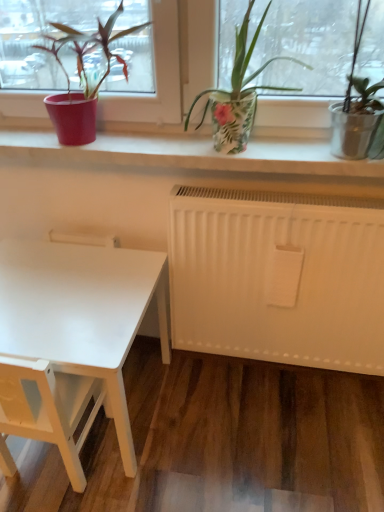
The width and height of the screenshot is (384, 512). Describe the element at coordinates (238, 93) in the screenshot. I see `floral-patterned pot at center, the first houseplant in the right-to-left sequence` at that location.

This screenshot has width=384, height=512. Find the location of `white matte table at lower left`. white matte table at lower left is located at coordinates (82, 314).

At what (x,y) coordinates should I click in order to perform the action: click on floral-patterned pot at center, acting as the 2th houseplant starting from the left. Please return your answer as a coordinate pair (x, y). Looking at the image, I should click on click(238, 93).

Based on the photo, from a real-world perspective, which object stands above the other?

floral-patterned pot at center, the first houseplant in the right-to-left sequence.

Who is more distant, white matte table at lower left or floral-patterned pot at center, acting as the 2th houseplant starting from the left?

Positioned behind is white matte table at lower left.

Is white matte table at lower left turned away from floral-patterned pot at center, the first houseplant in the right-to-left sequence?

That's not correct — white matte table at lower left is not looking away from floral-patterned pot at center, the first houseplant in the right-to-left sequence.

From a real-world perspective, which is physically below, floral-patterned pot at center, the first houseplant in the right-to-left sequence, or white matte table at lower left?

In real-world perspective, white matte table at lower left is lower.

Looking at this image, is floral-patterned pot at center, acting as the 2th houseplant starting from the left, wider than white matte table at lower left?

Incorrect, the width of floral-patterned pot at center, acting as the 2th houseplant starting from the left, does not surpass that of white matte table at lower left.

Between floral-patterned pot at center, the first houseplant in the right-to-left sequence, and white matte table at lower left, which one has smaller size?

floral-patterned pot at center, the first houseplant in the right-to-left sequence.

Can you confirm if floral-patterned pot at center, the first houseplant in the right-to-left sequence, is taller than white matte table at lower left?

No.

Would you say floral-patterned pot at center, acting as the 2th houseplant starting from the left, is a long distance from matte red pot at left, which is counted as the second houseplant, starting from the right?

floral-patterned pot at center, acting as the 2th houseplant starting from the left, is actually quite close to matte red pot at left, which is counted as the second houseplant, starting from the right.

From the image's perspective, is floral-patterned pot at center, acting as the 2th houseplant starting from the left, under matte red pot at left, arranged as the 1th houseplant when viewed from the left?

Indeed, from the image's perspective, floral-patterned pot at center, acting as the 2th houseplant starting from the left, is shown beneath matte red pot at left, arranged as the 1th houseplant when viewed from the left.

Is floral-patterned pot at center, acting as the 2th houseplant starting from the left, inside or outside of matte red pot at left, which is counted as the second houseplant, starting from the right?

floral-patterned pot at center, acting as the 2th houseplant starting from the left, is not inside matte red pot at left, which is counted as the second houseplant, starting from the right, it's outside.

Would you say floral-patterned pot at center, acting as the 2th houseplant starting from the left, is to the left or to the right of matte red pot at left, arranged as the 1th houseplant when viewed from the left, in the picture?

From the image, it's evident that floral-patterned pot at center, acting as the 2th houseplant starting from the left, is to the right of matte red pot at left, arranged as the 1th houseplant when viewed from the left.

From the image's perspective, would you say matte red pot at left, which is counted as the second houseplant, starting from the right, is positioned over white matte table at lower left?

Yes.

Is matte red pot at left, arranged as the 1th houseplant when viewed from the left, not close to white matte table at lower left?

matte red pot at left, arranged as the 1th houseplant when viewed from the left, is near white matte table at lower left, not far away.

Which object is wider, matte red pot at left, which is counted as the second houseplant, starting from the right, or white matte table at lower left?

Wider between the two is white matte table at lower left.

Is white matte table at lower left turned away from white matte table at lower left?

Yes, white matte table at lower left is facing away from white matte table at lower left.

Looking at this image, is white matte table at lower left not near white matte table at lower left?

No, white matte table at lower left is in close proximity to white matte table at lower left.

From the image's perspective, which is below, white matte table at lower left or white matte table at lower left?

white matte table at lower left is shown below in the image.

What's the angular difference between white matte table at lower left and matte red pot at left, arranged as the 1th houseplant when viewed from the left,'s facing directions?

They differ by 178 degrees in their facing directions.

Is the surface of white matte table at lower left in direct contact with matte red pot at left, which is counted as the second houseplant, starting from the right?

No.

Consider the image. From their relative heights in the image, would you say white matte table at lower left is taller or shorter than matte red pot at left, which is counted as the second houseplant, starting from the right?

Clearly, white matte table at lower left is taller compared to matte red pot at left, which is counted as the second houseplant, starting from the right.

Is white matte table at lower left facing away from matte red pot at left, which is counted as the second houseplant, starting from the right?

No, white matte table at lower left's orientation is not away from matte red pot at left, which is counted as the second houseplant, starting from the right.

Which of these two, floral-patterned pot at center, acting as the 2th houseplant starting from the left, or white matte table at lower left, stands shorter?

floral-patterned pot at center, acting as the 2th houseplant starting from the left.

Can you confirm if floral-patterned pot at center, the first houseplant in the right-to-left sequence, is wider than white matte table at lower left?

Incorrect, the width of floral-patterned pot at center, the first houseplant in the right-to-left sequence, does not surpass that of white matte table at lower left.

Could you tell me if floral-patterned pot at center, acting as the 2th houseplant starting from the left, is facing white matte table at lower left?

No, floral-patterned pot at center, acting as the 2th houseplant starting from the left, is not aimed at white matte table at lower left.

Is floral-patterned pot at center, the first houseplant in the right-to-left sequence, far away from white matte table at lower left?

floral-patterned pot at center, the first houseplant in the right-to-left sequence, is actually quite close to white matte table at lower left.

This screenshot has width=384, height=512. What are the coordinates of `houseplant that is the 1st object located above the white matte table at lower left (from the image's perspective)` in the screenshot? It's located at [x=238, y=93].

You are a GUI agent. You are given a task and a screenshot of the screen. Output one action in this format:
    pyautogui.click(x=<x>, y=<y>)
    Task: Click on the table below the floral-patterned pot at center, acting as the 2th houseplant starting from the left (from a real-world perspective)
    Image resolution: width=384 pixels, height=512 pixels.
    Given the screenshot: What is the action you would take?
    pyautogui.click(x=82, y=314)

Based on the photo, when comparing their distances from white matte table at lower left, does matte red pot at left, which is counted as the second houseplant, starting from the right, or floral-patterned pot at center, the first houseplant in the right-to-left sequence, seem closer?

matte red pot at left, which is counted as the second houseplant, starting from the right, is closer to white matte table at lower left.

Looking at the image, which one is located further to matte red pot at left, which is counted as the second houseplant, starting from the right, white matte table at lower left or floral-patterned pot at center, the first houseplant in the right-to-left sequence?

Among the two, white matte table at lower left is located further to matte red pot at left, which is counted as the second houseplant, starting from the right.

Which object lies further to the anchor point matte red pot at left, arranged as the 1th houseplant when viewed from the left, white matte table at lower left or floral-patterned pot at center, the first houseplant in the right-to-left sequence?

white matte table at lower left.

Based on their spatial positions, is floral-patterned pot at center, acting as the 2th houseplant starting from the left, or white matte table at lower left further from matte red pot at left, which is counted as the second houseplant, starting from the right?

Based on the image, white matte table at lower left appears to be further to matte red pot at left, which is counted as the second houseplant, starting from the right.

Considering their positions, is white matte table at lower left positioned further to white matte table at lower left than matte red pot at left, which is counted as the second houseplant, starting from the right?

Based on the image, matte red pot at left, which is counted as the second houseplant, starting from the right, appears to be further to white matte table at lower left.

From the picture: Which object lies nearer to the anchor point white matte table at lower left, floral-patterned pot at center, the first houseplant in the right-to-left sequence, or white matte table at lower left?

white matte table at lower left is positioned closer to the anchor white matte table at lower left.

From the image, which object appears to be farther from matte red pot at left, which is counted as the second houseplant, starting from the right, white matte table at lower left or white matte table at lower left?

Based on the image, white matte table at lower left appears to be further to matte red pot at left, which is counted as the second houseplant, starting from the right.

When comparing their distances from floral-patterned pot at center, the first houseplant in the right-to-left sequence, does white matte table at lower left or white matte table at lower left seem closer?

white matte table at lower left.

Where is `houseplant between matte red pot at left, arranged as the 1th houseplant when viewed from the left, and white matte table at lower left in the up-down direction`? This screenshot has height=512, width=384. houseplant between matte red pot at left, arranged as the 1th houseplant when viewed from the left, and white matte table at lower left in the up-down direction is located at coordinates (238, 93).

This screenshot has height=512, width=384. I want to click on table between matte red pot at left, which is counted as the second houseplant, starting from the right, and white matte table at lower left vertically, so click(82, 314).

The image size is (384, 512). Find the location of `houseplant between matte red pot at left, arranged as the 1th houseplant when viewed from the left, and white matte table at lower left from top to bottom`. houseplant between matte red pot at left, arranged as the 1th houseplant when viewed from the left, and white matte table at lower left from top to bottom is located at coordinates (238, 93).

Identify the location of table between floral-patterned pot at center, acting as the 2th houseplant starting from the left, and white matte table at lower left, in the vertical direction. The image size is (384, 512). (82, 314).